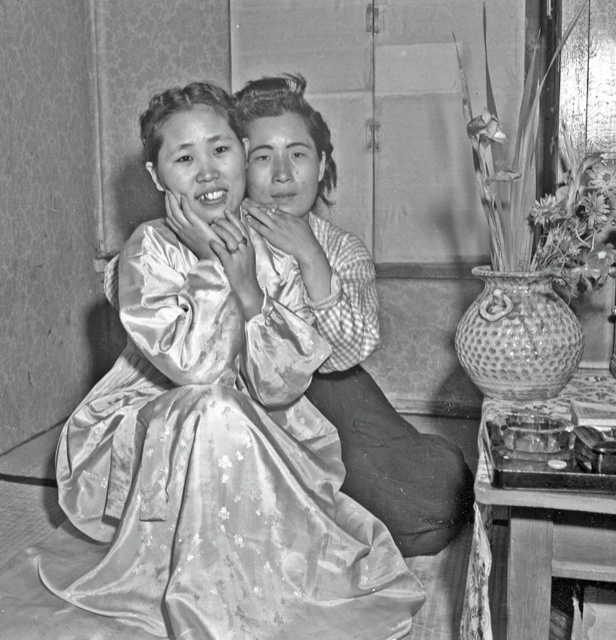
Looking at the black and white photo, there are two women wearing traditional Korean clothing. The woman on the left is in a silky satin dress at center, and the one on the right is in a silky satin kimono at center. Which of their outfits is positioned to the left?

The silky satin dress at center is positioned to the left of the silky satin kimono at center.

You are a fashion designer who wants to create a new collection inspired by traditional Korean attire. You have two garments in front of you, the silky satin dress at center and the silky satin kimono at center. Which garment takes up less space when laid out flat?

The silky satin dress at center occupies less space than the silky satin kimono at center when laid out flat.